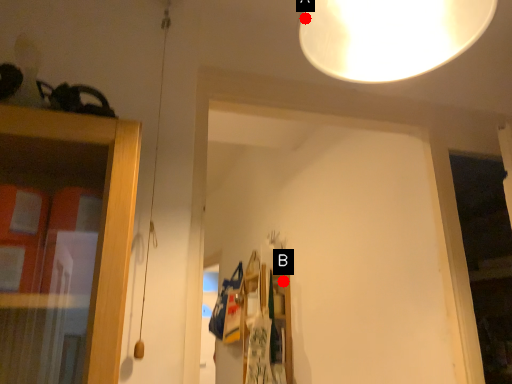
Question: Two points are circled on the image, labeled by A and B beside each circle. Which point is farther to the camera?

Choices:
 (A) A is further
 (B) B is further

Answer: (B)